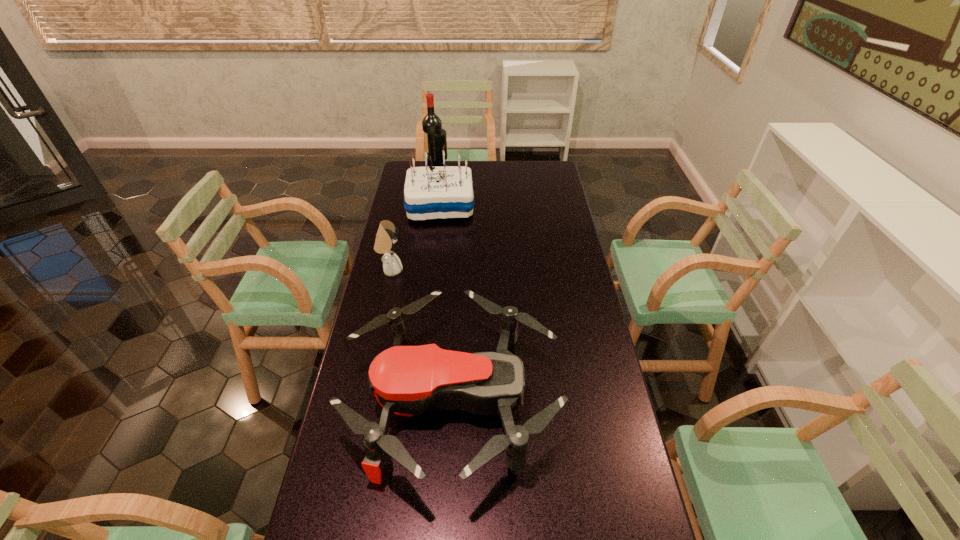
Find the location of a particular element. wine bottle is located at coordinates (431, 124).

In order to click on the farthest object in this screenshot , I will do `click(431, 124)`.

Locate an element on the screen. This screenshot has height=540, width=960. the second farthest object is located at coordinates (430, 192).

Locate an element on the screen. The height and width of the screenshot is (540, 960). doll is located at coordinates (386, 236).

Where is `the second shortest object`? the second shortest object is located at coordinates (386, 236).

This screenshot has width=960, height=540. Identify the location of the shortest object. (406, 380).

The height and width of the screenshot is (540, 960). In order to click on the nearest object in this screenshot , I will do `click(406, 380)`.

What are the coordinates of `free space located 0.300m on the right of the farthest object` in the screenshot? It's located at (507, 166).

You are a GUI agent. You are given a task and a screenshot of the screen. Output one action in this format:
    pyautogui.click(x=<x>, y=<y>)
    Task: Click on the blank area located 0.360m on the front of the birthday cake
    
    Given the screenshot: What is the action you would take?
    pos(431,285)

Identify the location of blank space located at the front face of the second nearest object. This screenshot has width=960, height=540. (472, 270).